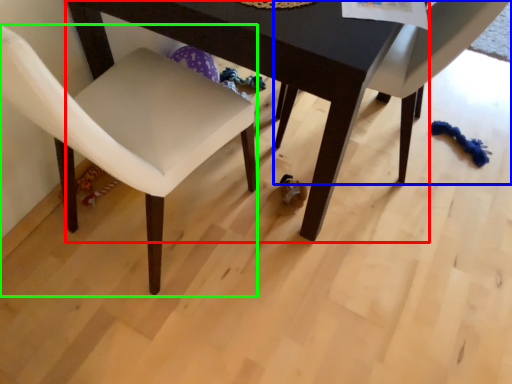
Question: Which is nearer to the table (highlighted by a red box)? chair (highlighted by a blue box) or chair (highlighted by a green box).

Choices:
 (A) chair
 (B) chair

Answer: (B)